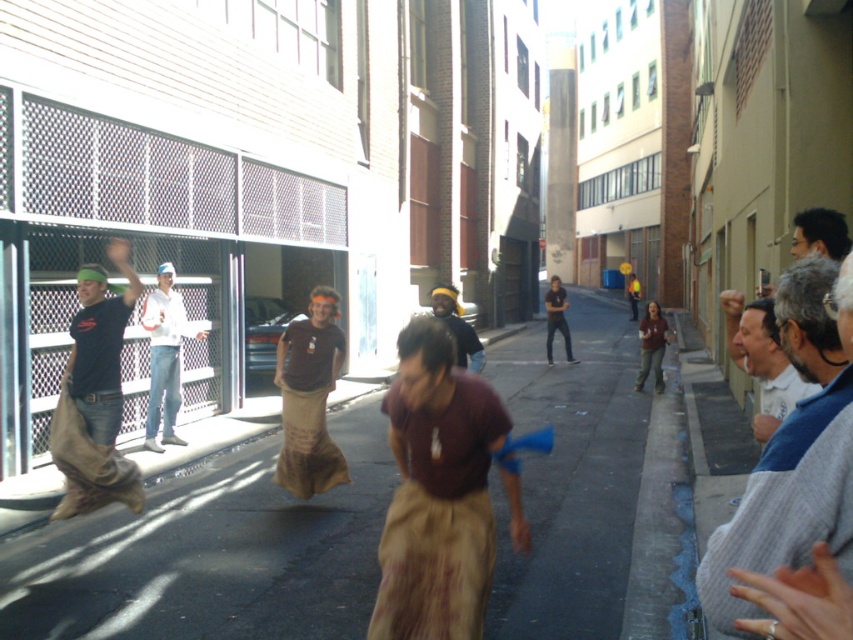
Question: Which of the following is the farthest from the observer?

Choices:
 (A) brown cotton shirt at center
 (B) brown sack at center
 (C) brown fabric sack at center
 (D) gray knit sweater at right

Answer: (A)

Question: Does gray knit sweater at right appear on the right side of gray wool sweater at right?

Choices:
 (A) no
 (B) yes

Answer: (A)

Question: Among these objects, which one is nearest to the camera?

Choices:
 (A) brown cotton shirt at center
 (B) brown sack at center

Answer: (B)

Question: In this image, where is dark brown fabric pants at center located relative to dark blue shirt at center?

Choices:
 (A) below
 (B) above

Answer: (A)

Question: Is gray knit sweater at right positioned at the back of gray wool sweater at right?

Choices:
 (A) yes
 (B) no

Answer: (B)

Question: Which object is positioned closest to the white shirt at right?

Choices:
 (A) dark blue shirt at center
 (B) brown fabric sack at center
 (C) dark brown fabric pants at center

Answer: (C)